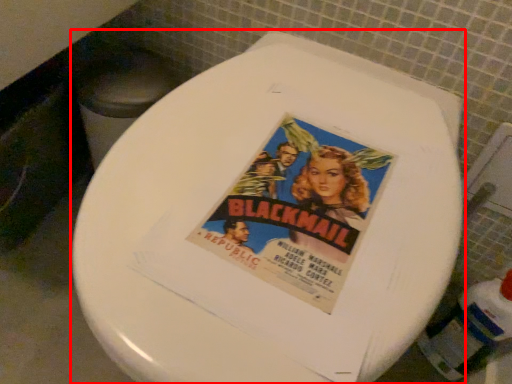
Question: From the image, what is the correct spatial relationship of toilet (annotated by the red box) in relation to bottle?

Choices:
 (A) left
 (B) right

Answer: (A)